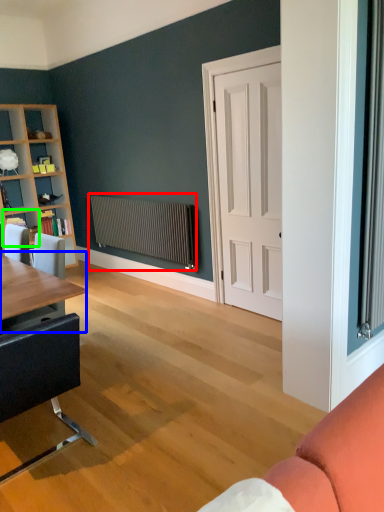
Question: Which is nearer to the radiator (highlighted by a red box)? table (highlighted by a blue box) or shelf (highlighted by a green box).

Choices:
 (A) table
 (B) shelf

Answer: (B)